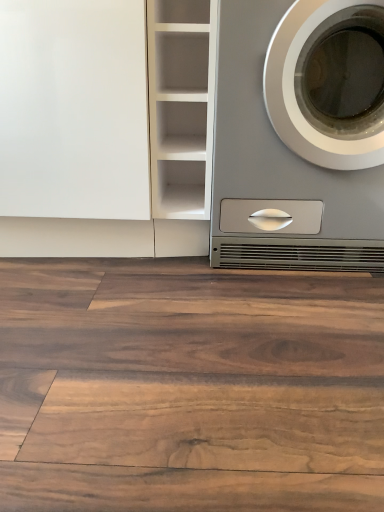
Question: Considering their positions, is white matte cabinet at center located in front of or behind brown wood flooring at center?

Choices:
 (A) front
 (B) behind

Answer: (B)

Question: Would you say white matte cabinet at center is inside or outside brown wood flooring at center?

Choices:
 (A) inside
 (B) outside

Answer: (B)

Question: Estimate the real-world distances between objects in this image. Which object is farther from the white matte cabinet at center?

Choices:
 (A) white glossy cabinet at upper left
 (B) brown wood flooring at center
 (C) satin silver washing machine at right

Answer: (B)

Question: Estimate the real-world distances between objects in this image. Which object is closer to the white matte cabinet at center?

Choices:
 (A) brown wood flooring at center
 (B) white glossy cabinet at upper left
 (C) satin silver washing machine at right

Answer: (B)